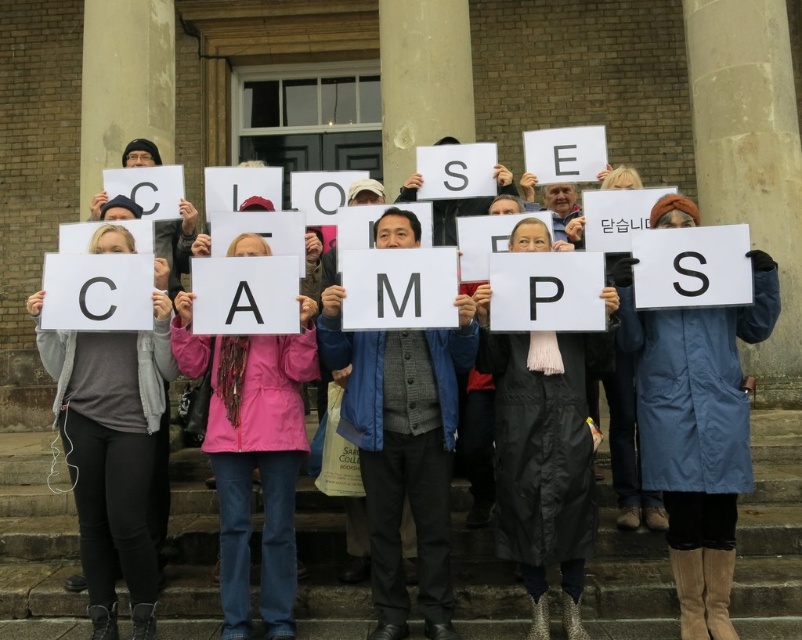
Question: Which of the following is the farthest from the observer?

Choices:
 (A) matte gray jacket at center
 (B) blue fabric coat at center
 (C) concrete stairs at center
 (D) gray fabric at center

Answer: (B)

Question: Which object appears farthest from the camera in this image?

Choices:
 (A) matte gray jacket at center
 (B) concrete stairs at center
 (C) pink fabric jacket at center

Answer: (C)

Question: Is white paper sign at center to the left of gray fabric at center from the viewer's perspective?

Choices:
 (A) no
 (B) yes

Answer: (A)

Question: Estimate the real-world distances between objects in this image. Which object is farther from the blue fabric coat at center?

Choices:
 (A) concrete stairs at center
 (B) pink fabric jacket at center

Answer: (B)

Question: Can you confirm if white paper sign at center is positioned to the left of pink fabric jacket at center?

Choices:
 (A) yes
 (B) no

Answer: (B)

Question: Can you confirm if concrete stairs at center is positioned above black matte coat at center?

Choices:
 (A) yes
 (B) no

Answer: (B)